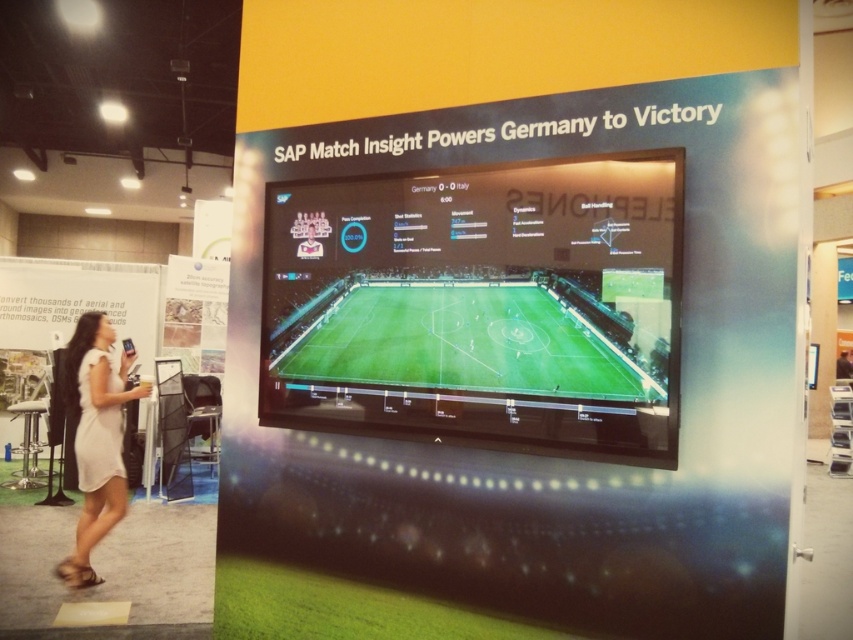
Question: Does black glossy screen at center appear on the right side of green artificial turf at center?

Choices:
 (A) no
 (B) yes

Answer: (A)

Question: Estimate the real-world distances between objects in this image. Which object is farther from the black glossy screen at center?

Choices:
 (A) white matte dress at lower left
 (B) green artificial turf at center

Answer: (A)

Question: Which of the following is the farthest from the observer?

Choices:
 (A) green artificial turf at center
 (B) black glossy screen at center
 (C) white matte dress at lower left

Answer: (C)

Question: Where is black glossy screen at center located in relation to white matte dress at lower left in the image?

Choices:
 (A) right
 (B) left

Answer: (A)

Question: Which of these objects is positioned closest to the black glossy screen at center?

Choices:
 (A) white matte dress at lower left
 (B) green artificial turf at center

Answer: (B)

Question: Can you confirm if green artificial turf at center is thinner than white matte dress at lower left?

Choices:
 (A) no
 (B) yes

Answer: (A)